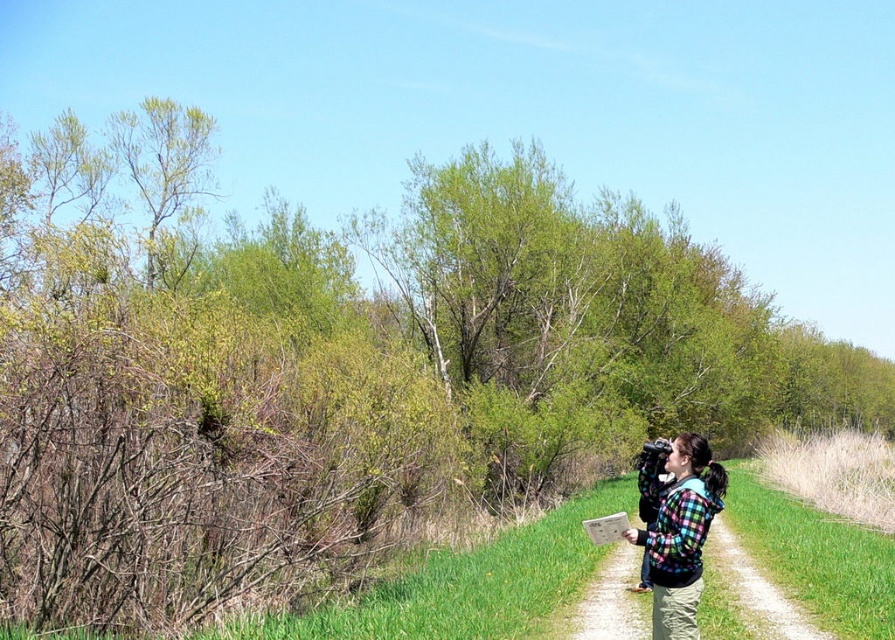
You are planning to walk from the green grass at lower center to the plaid fleece jacket at right. Which direction should you move to get closer to the jacket?

To move closer to the plaid fleece jacket at right, you should walk towards the right side of the path since the jacket is located there.

You are standing on the dirt path and want to move to the plaid fleece jacket at right. Which direction should you walk to avoid stepping on the green grass at lower center?

To avoid stepping on the green grass at lower center, you should walk to the left side of the plaid fleece jacket at right since the green grass at lower center is positioned on the right side of it.

You are standing at the starting point of the dirt path and want to reach the plaid fleece jacket at right without stepping on the green grass at lower center. What is the minimum distance you need to walk around the grass to reach the jacket?

The minimum distance you need to walk around the green grass at lower center to reach the plaid fleece jacket at right is approximately 8.29 meters, as the grass is positioned directly between you and the jacket, requiring a detour of that length.